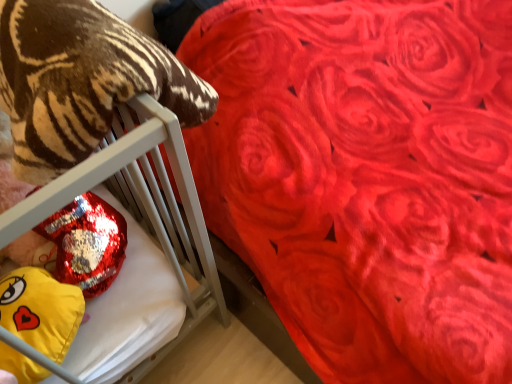
Where is `vacant space to the right of yellow plush at left`? Image resolution: width=512 pixels, height=384 pixels. vacant space to the right of yellow plush at left is located at coordinates (134, 313).